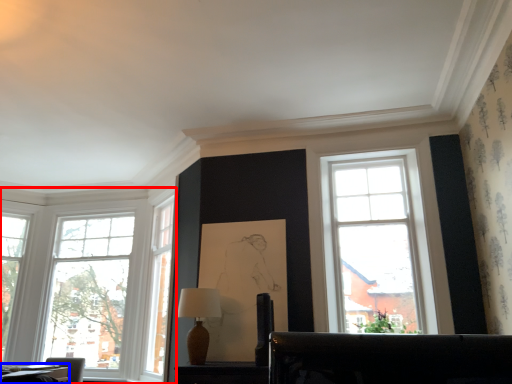
Question: Among these objects, which one is nearest to the camera, window (highlighted by a red box) or table (highlighted by a blue box)?

Choices:
 (A) window
 (B) table

Answer: (B)